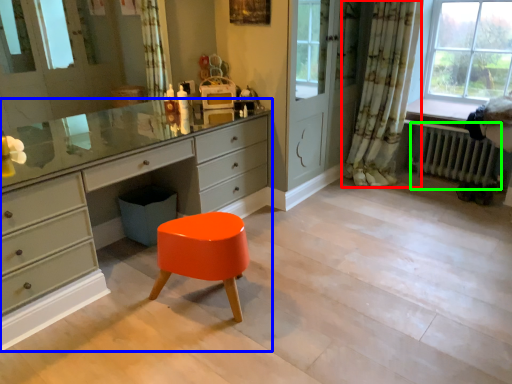
Question: Which is farther away from curtain (highlighted by a red box)? chest of drawers (highlighted by a blue box) or radiator (highlighted by a green box)?

Choices:
 (A) chest of drawers
 (B) radiator

Answer: (A)